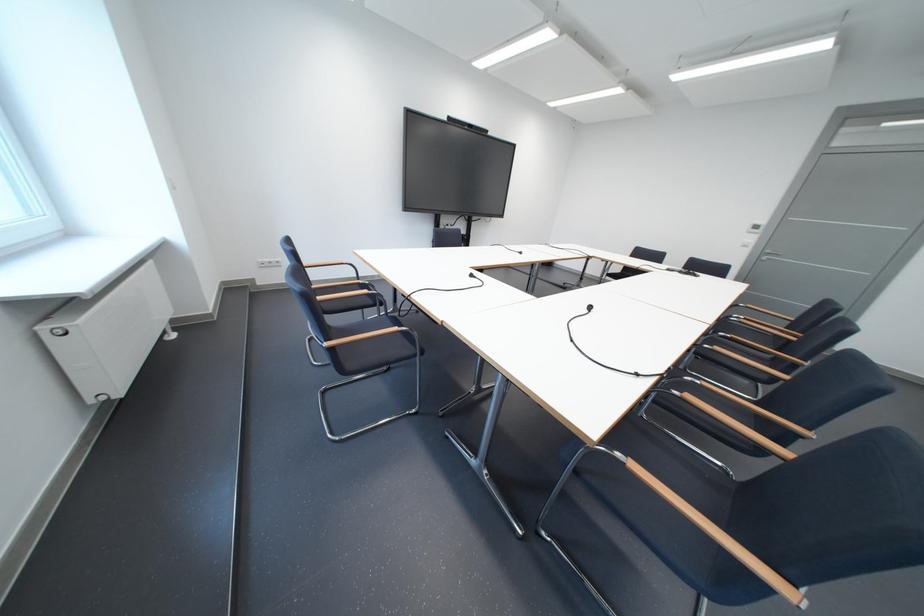
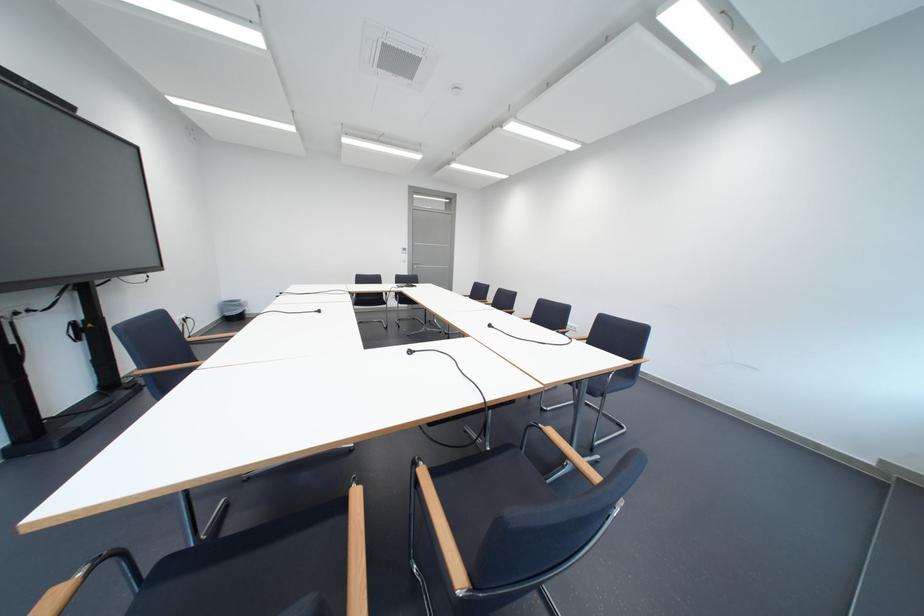
Where in the second image is the point corresponding to pixel 775 256 from the first image?

(426, 265)